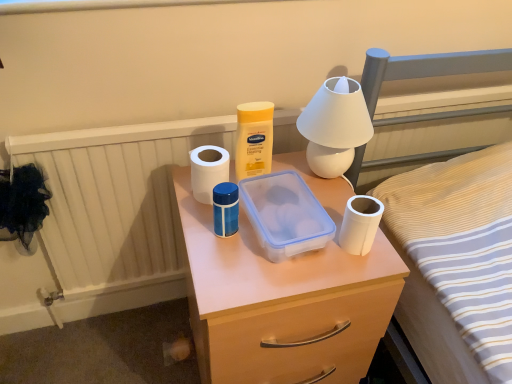
Locate an element on the screen. This screenshot has height=384, width=512. vacant region in front of transparent plastic container at center is located at coordinates (274, 282).